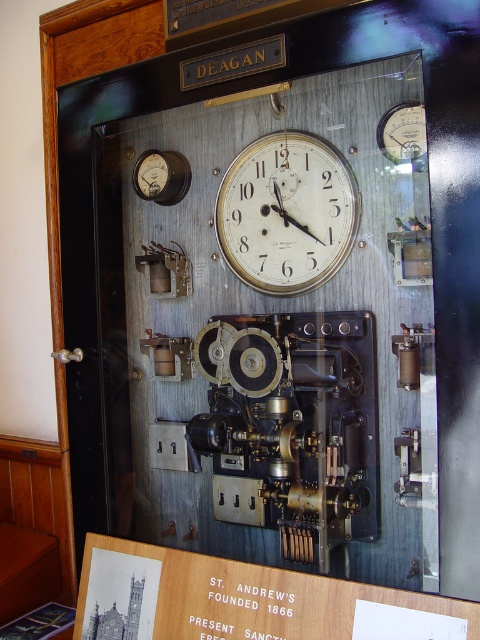
You are a clock repair technician who needs to adjust the time on the white metallic clock at center. The tool you need is placed on the matte silver gauge at upper right. Can you reach the tool without moving your position? Please explain based on the distance between them.

The white metallic clock at center and the matte silver gauge at upper right are 10.08 inches apart. Since the tool is on the matte silver gauge at upper right, you can reach it without moving your position as the distance is manageable for typical arm length.

Looking at this image, you are an engineer inspecting the Deagan clock display. You notice the white metallic clock at center and the matte silver gauge at upper right. Which object is closer to you from your current viewpoint?

The white metallic clock at center is closer to you because the matte silver gauge at upper right is positioned behind it.

You are holding a camera that requires a minimum distance of 1.5 meters to focus properly. You want to take a clear photo of the white metallic clock at center. Can you stand where you are now and take the photo without moving closer?

The white metallic clock at center and camera are 1.45 meters apart from each other. Since the minimum focusing distance is 1.5 meters, you need to move back 5 centimeters to ensure proper focus.